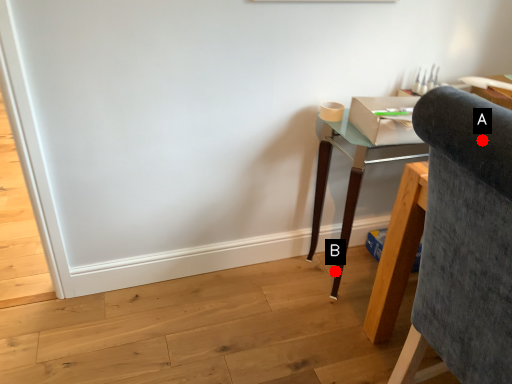
Question: Two points are circled on the image, labeled by A and B beside each circle. Which point is farther to the camera?

Choices:
 (A) A is further
 (B) B is further

Answer: (B)